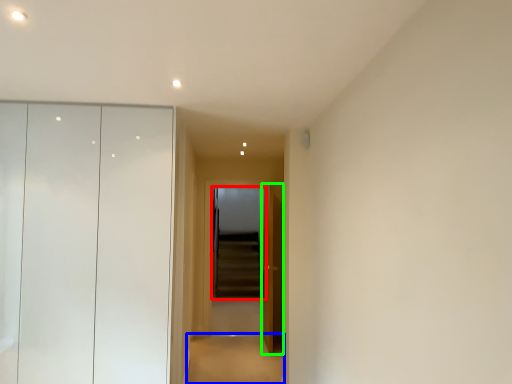
Question: Based on their relative distances, which object is farther from screen door (highlighted by a red box)? Choose from path (highlighted by a blue box) and door (highlighted by a green box).

Choices:
 (A) path
 (B) door

Answer: (B)